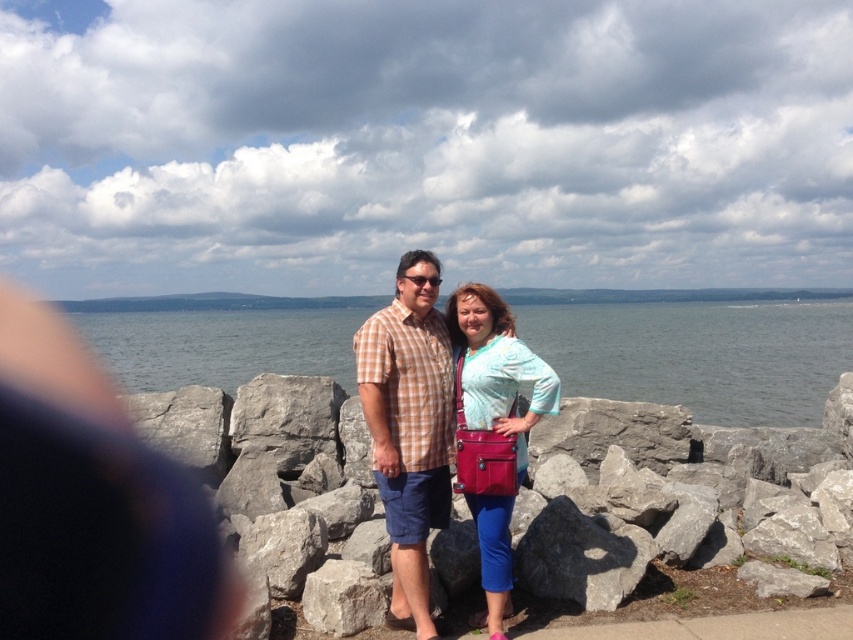
You are a photographer trying to capture the matte pink purse at center and the gray rough rock at center in the same frame. Based on their positions, which object would appear closer to the camera in the photo?

The matte pink purse at center appears closer to the camera than the gray rough rock at center because it is positioned in front of it.

You are a photographer trying to capture a closeup of the matte pink purse at center and the gray rough rock at center. Which object should you zoom in on to ensure both are in focus if your camera can only focus on one object at a time?

The matte pink purse at center is taller than the gray rough rock at center, so you should zoom in on the matte pink purse at center to ensure both are in focus.

You are a photographer trying to capture the scene with the gray water at center and the matte pink purse at center. Which object should you focus on first if you want to ensure both are in focus?

The matte pink purse at center is lower than the gray water at center, so focusing on the matte pink purse at center first will help ensure both are in focus as it is closer to the camera.